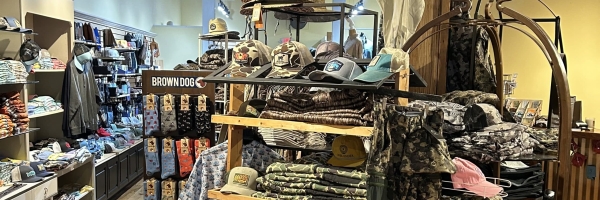
The height and width of the screenshot is (200, 600). Identify the location of floor. (131, 191).